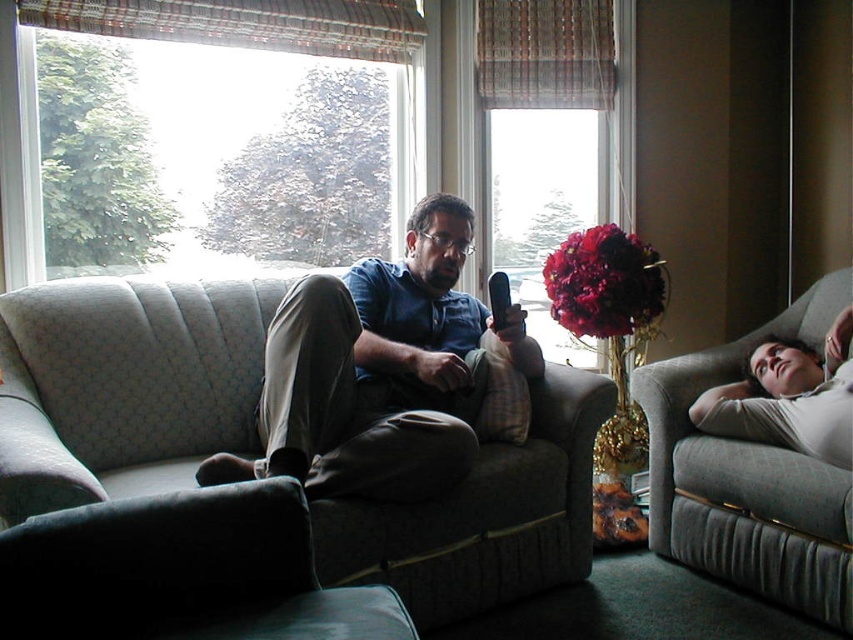
Does matte blue shirt at center appear on the left side of velvety red bouquet at center?

Indeed, matte blue shirt at center is positioned on the left side of velvety red bouquet at center.

Which is above, matte blue shirt at center or velvety red bouquet at center?

Positioned higher is velvety red bouquet at center.

Which is behind, point (462, 208) or point (576, 237)?

Positioned behind is point (576, 237).

Identify the location of matte blue shirt at center. This screenshot has width=853, height=640. (383, 372).

Based on the photo, which of these two, gray fabric couch at right or velvety red bouquet at center, stands shorter?

Standing shorter between the two is velvety red bouquet at center.

Does gray fabric couch at right have a greater width compared to velvety red bouquet at center?

Indeed, gray fabric couch at right has a greater width compared to velvety red bouquet at center.

Image resolution: width=853 pixels, height=640 pixels. What do you see at coordinates (750, 480) in the screenshot?
I see `gray fabric couch at right` at bounding box center [750, 480].

Locate an element on the screen. The width and height of the screenshot is (853, 640). gray fabric couch at right is located at coordinates (750, 480).

In the scene shown: Does matte blue shirt at center have a lesser height compared to dark gray fabric ottoman at lower left?

In fact, matte blue shirt at center may be taller than dark gray fabric ottoman at lower left.

Who is positioned more to the right, matte blue shirt at center or dark gray fabric ottoman at lower left?

From the viewer's perspective, matte blue shirt at center appears more on the right side.

Where is `matte blue shirt at center`? Image resolution: width=853 pixels, height=640 pixels. matte blue shirt at center is located at coordinates (383, 372).

Where is `matte blue shirt at center`? matte blue shirt at center is located at coordinates (383, 372).